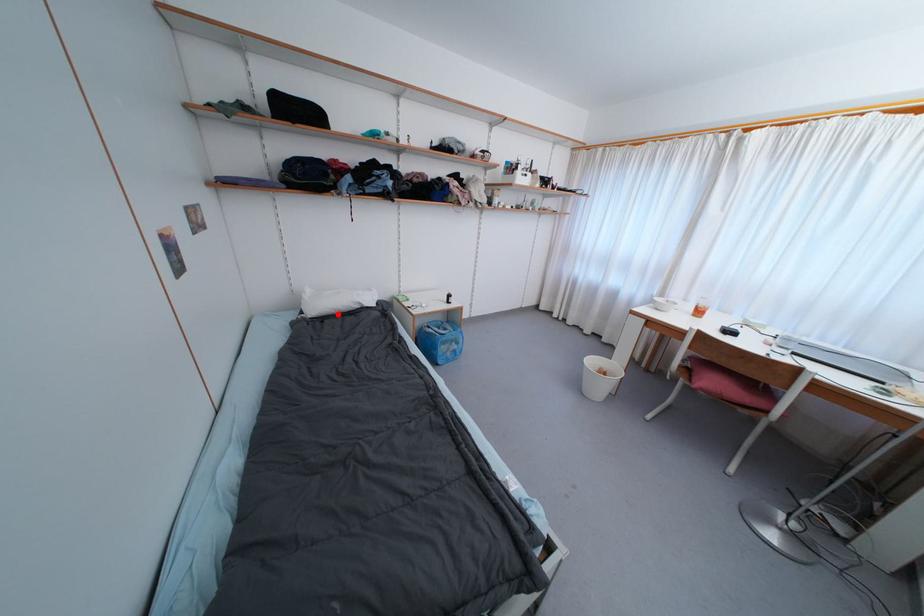
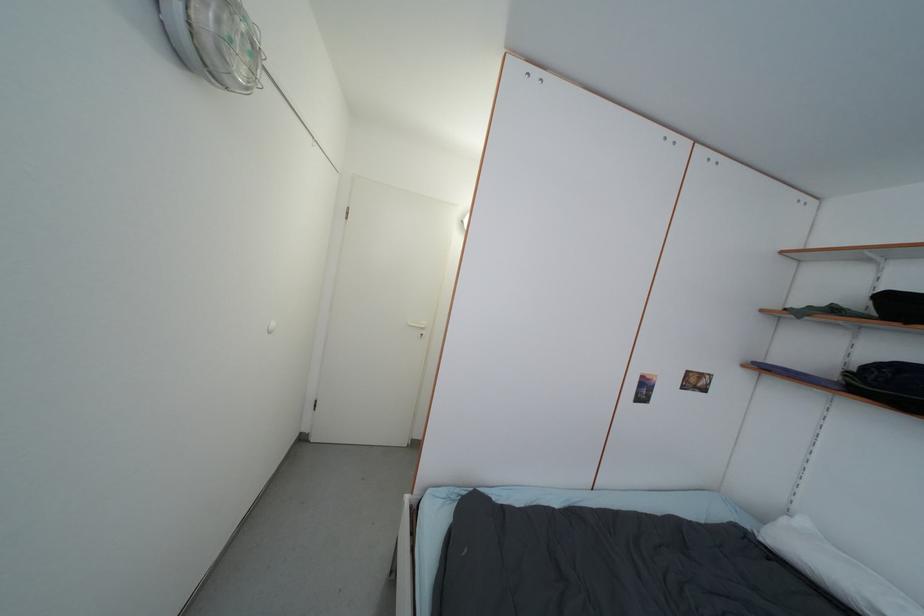
Find the pixel in the second image that matches the highlighted location in the first image.

(812, 576)